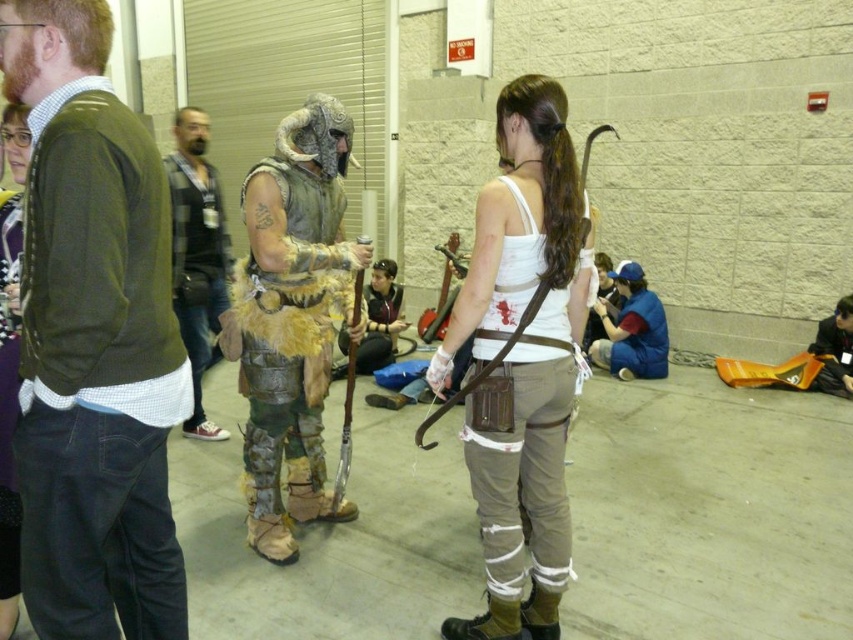
From the picture: You are standing in the convention hall and want to determine which of the two points, point (535, 115) or point (289, 179), is nearer to you. Based on the scene description, which point is closer?

Point (535, 115) is closer to the viewer than point (289, 179) according to the description.

You are a photographer positioned at the center of the scene. You need to capture a photo that includes both the dark gray flannel shirt at left and the blue fabric shirt at lower right. Given the camera you have can focus on objects within a 3 meter range, will you be able to include both in the same frame without moving?

The distance between the dark gray flannel shirt at left and the blue fabric shirt at lower right is 2.86 meters. Since the camera can focus within 3 meters, both objects can be included in the same frame without moving.